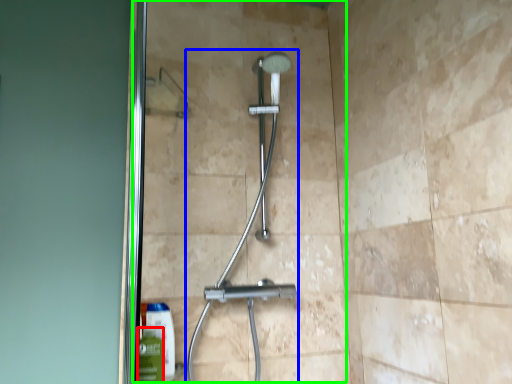
Question: Which object is positioned farthest from mouthwash (highlighted by a red box)? Select from shower (highlighted by a blue box) and glass door (highlighted by a green box).

Choices:
 (A) shower
 (B) glass door

Answer: (B)